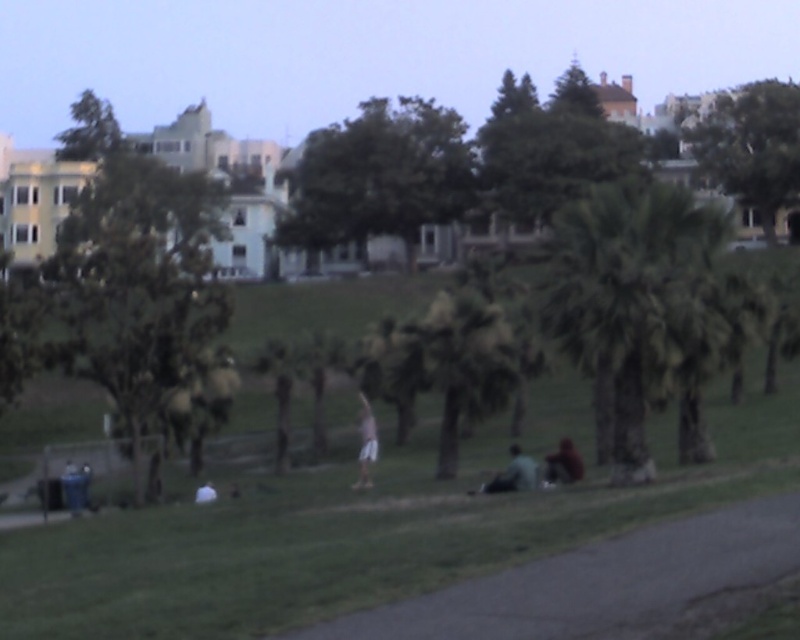
Find the location of a particular element. Image resolution: width=800 pixels, height=640 pixels. gray asphalt path at lower center is located at coordinates (608, 584).

Does gray asphalt path at lower center appear on the left side of dark green fabric at lower center?

Correct, you'll find gray asphalt path at lower center to the left of dark green fabric at lower center.

Which is behind, point (536, 636) or point (521, 452)?

Point (521, 452)

This screenshot has width=800, height=640. Identify the location of gray asphalt path at lower center. (608, 584).

Who is taller, white cotton shorts at center or dark brown leather jacket at lower center?

With more height is white cotton shorts at center.

Can you confirm if white cotton shorts at center is bigger than dark brown leather jacket at lower center?

Indeed, white cotton shorts at center has a larger size compared to dark brown leather jacket at lower center.

The height and width of the screenshot is (640, 800). Describe the element at coordinates (366, 444) in the screenshot. I see `white cotton shorts at center` at that location.

The width and height of the screenshot is (800, 640). I want to click on white cotton shorts at center, so click(x=366, y=444).

Does green leafy tree at left lie behind white cotton shirt at center?

Yes, green leafy tree at left is further from the viewer.

Is point (113, 280) more distant than point (212, 500)?

Yes, it is.

You are a GUI agent. You are given a task and a screenshot of the screen. Output one action in this format:
    pyautogui.click(x=<x>, y=<y>)
    Task: Click on the green leafy tree at left
    The image size is (800, 640).
    Given the screenshot: What is the action you would take?
    (x=134, y=273)

In order to click on green leafy tree at left in this screenshot , I will do `click(134, 273)`.